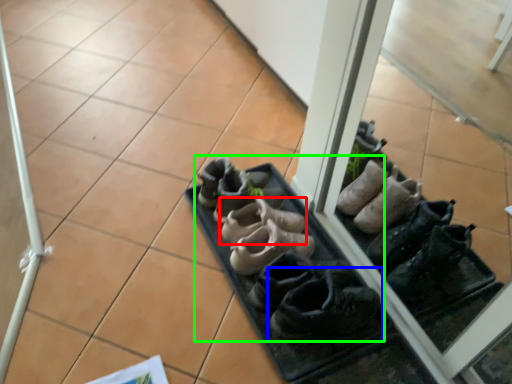
Question: Considering the real-world distances, which object is farthest from footwear (highlighted by a red box)? footwear (highlighted by a blue box) or footwear (highlighted by a green box)?

Choices:
 (A) footwear
 (B) footwear

Answer: (A)